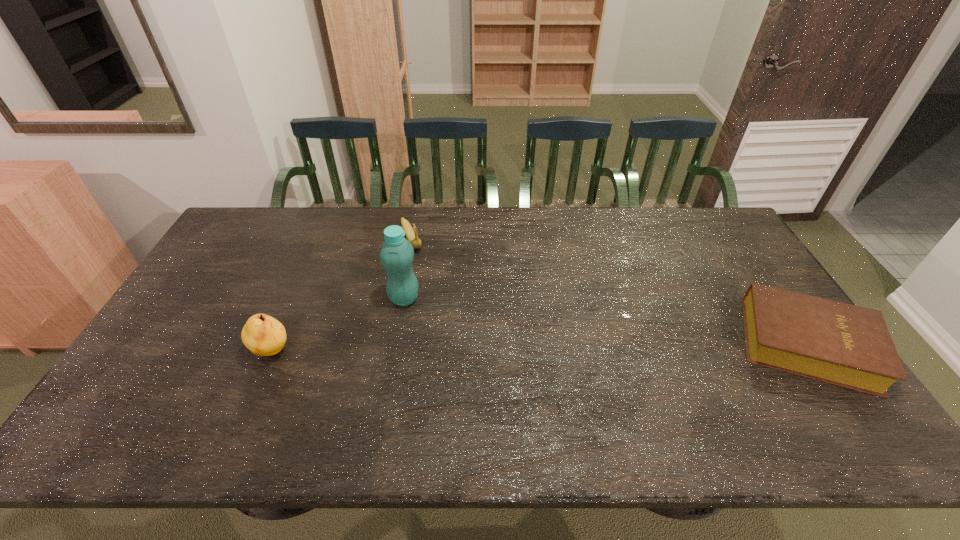
You are a GUI agent. You are given a task and a screenshot of the screen. Output one action in this format:
    pyautogui.click(x=<x>, y=<y>)
    Task: Click on the pear
    
    Given the screenshot: What is the action you would take?
    pyautogui.click(x=263, y=335)

This screenshot has height=540, width=960. I want to click on the third shortest object, so click(x=263, y=335).

Locate an element on the screen. The image size is (960, 540). the rightmost object is located at coordinates [842, 344].

Where is `the shortest object`? the shortest object is located at coordinates (842, 344).

Find the location of `the tallest object`. the tallest object is located at coordinates (397, 253).

Where is `the second shortest object`? The image size is (960, 540). the second shortest object is located at coordinates (412, 237).

At what (x,y) coordinates should I click in order to perform the action: click on banana. Please return your answer as a coordinate pair (x, y). Looking at the image, I should click on (412, 237).

This screenshot has height=540, width=960. I want to click on vacant space located 0.170m on the back of the pear, so click(x=298, y=293).

The width and height of the screenshot is (960, 540). What are the coordinates of `vacant point located on the back of the shortest object` in the screenshot? It's located at (759, 273).

At what (x,y) coordinates should I click in order to perform the action: click on vacant area situated at the front cap of the water bottle. Please return your answer as a coordinate pair (x, y). Looking at the image, I should click on (531, 372).